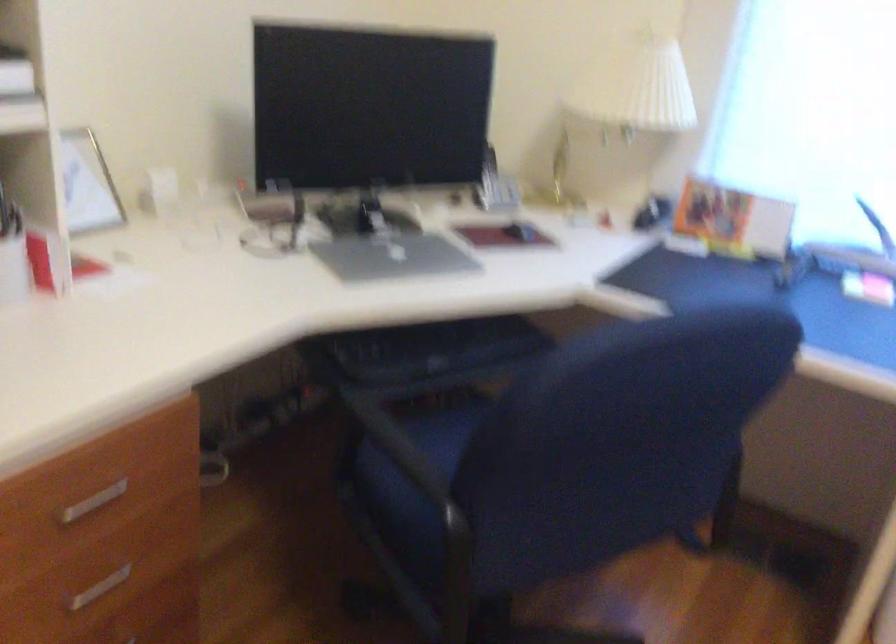
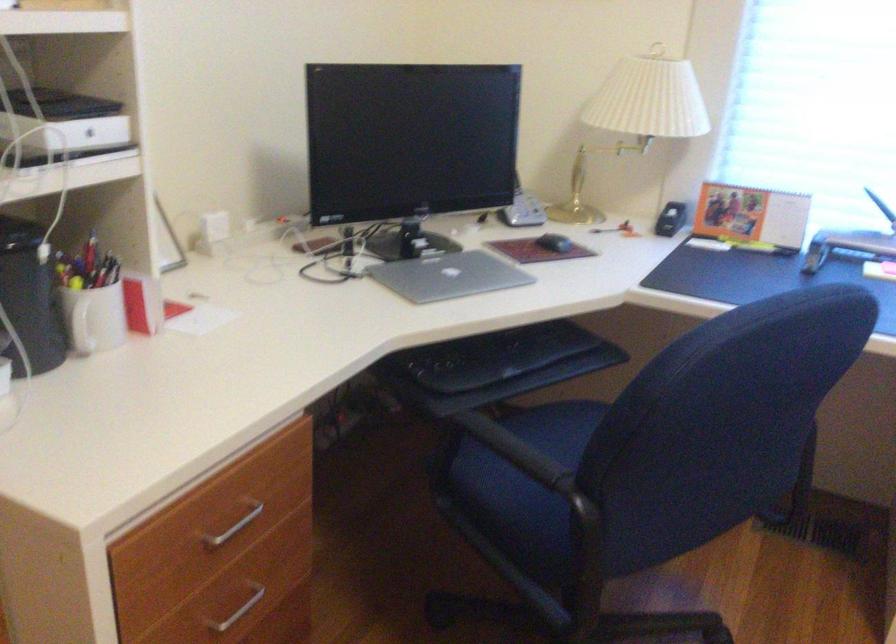
Find the pixel in the second image that matches (401,448) in the first image.

(513, 450)